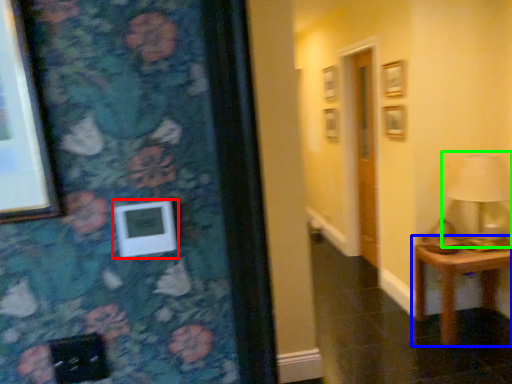
Question: Based on their relative distances, which object is farther from picture frame (highlighted by a red box)? Choose from table (highlighted by a blue box) and table lamp (highlighted by a green box).

Choices:
 (A) table
 (B) table lamp

Answer: (B)